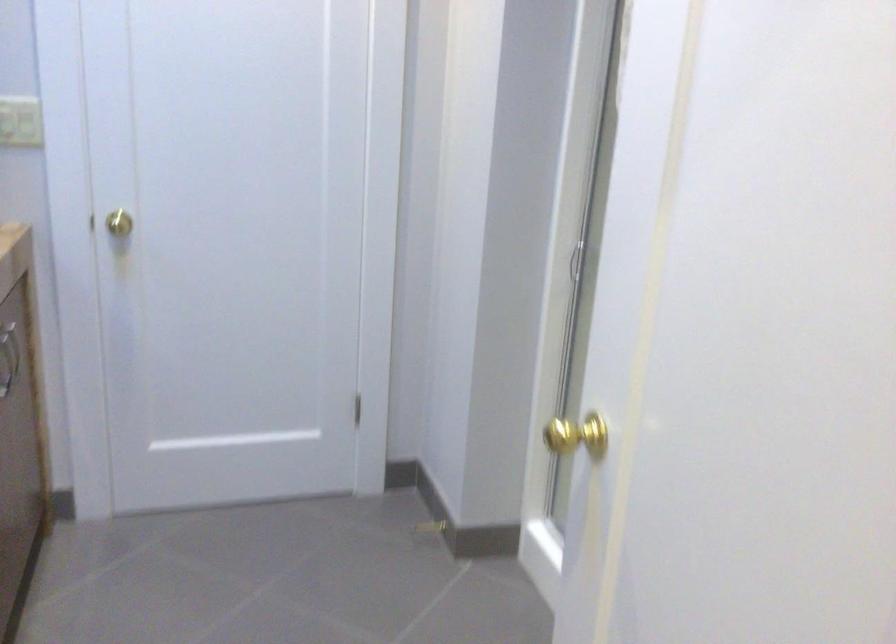
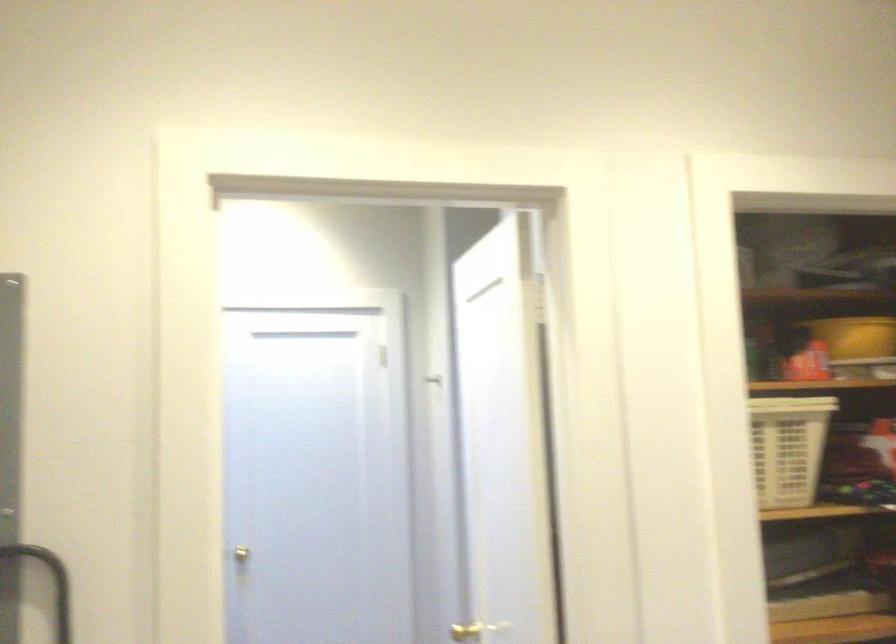
Find the pixel in the second image that matches pixel 582 431 in the first image.

(464, 632)